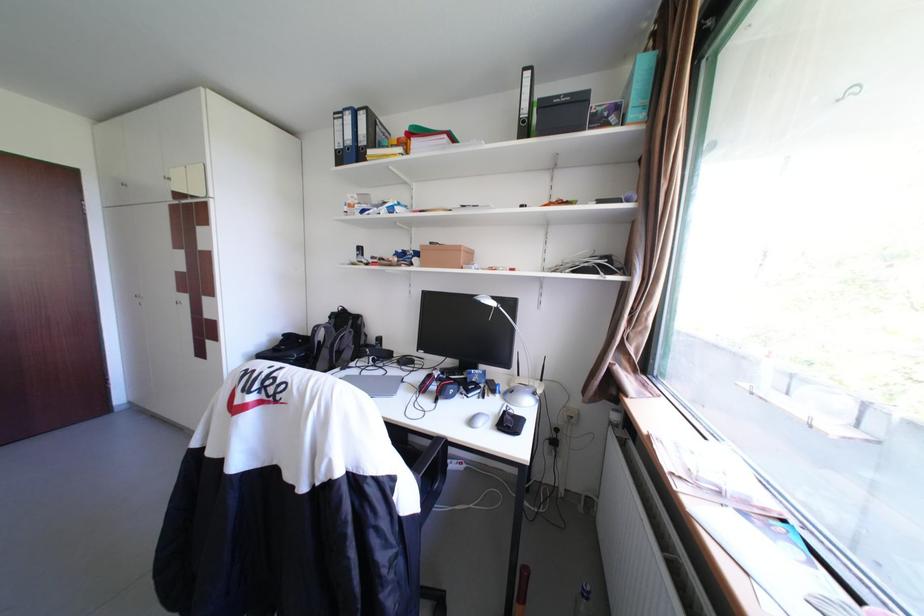
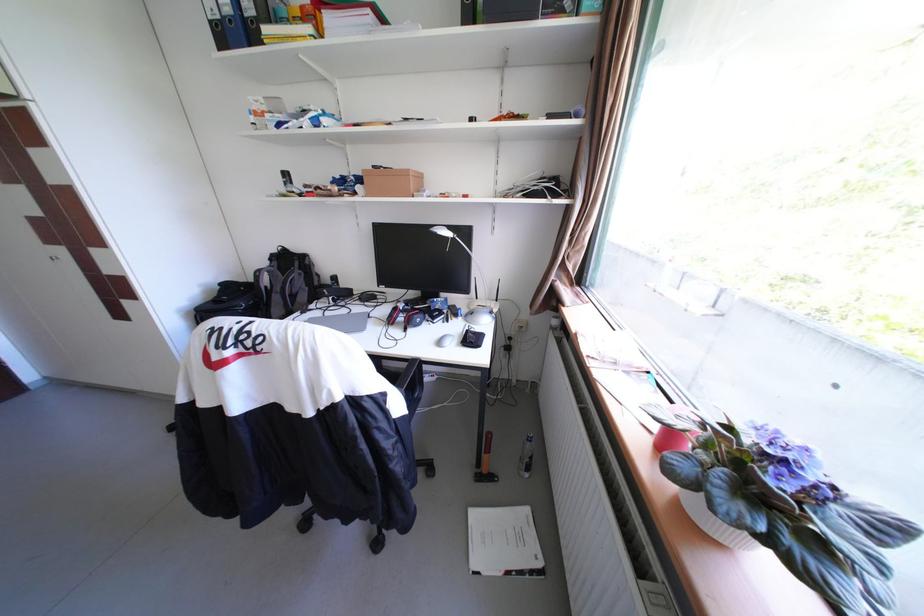
Question: How did the camera likely rotate?

Choices:
 (A) Left
 (B) Right
 (C) Up
 (D) Down

Answer: (D)